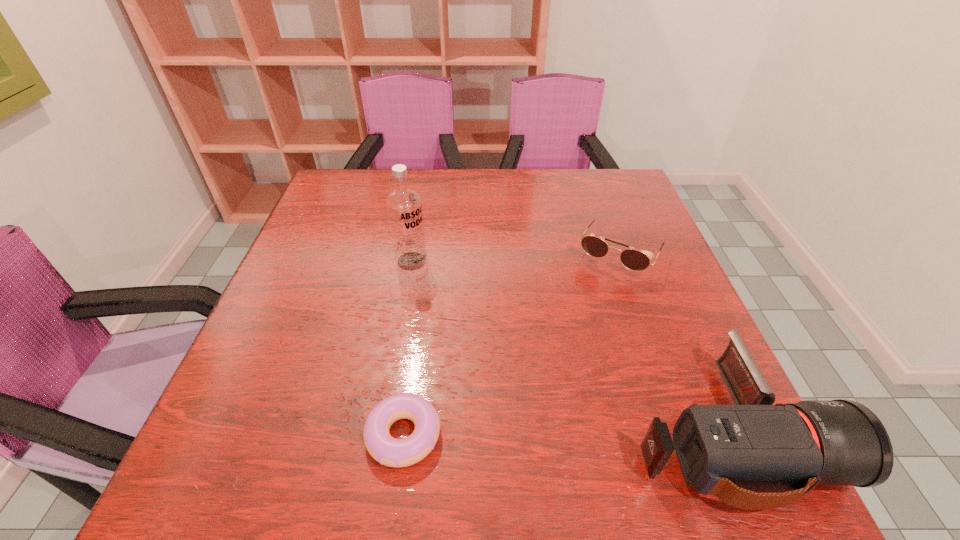
The height and width of the screenshot is (540, 960). I want to click on vacant area at the far left corner, so click(365, 186).

In the image, there is a desktop. Find the location of `vacant space at the far right corner`. vacant space at the far right corner is located at coordinates (628, 212).

Find the location of a particular element. vacant region between the doughnut and the second tallest object is located at coordinates (564, 434).

The image size is (960, 540). In order to click on empty space that is in between the doughnut and the second tallest object in this screenshot , I will do `click(564, 434)`.

Identify the location of free space between the shortest object and the sunglasses. tap(512, 345).

What are the coordinates of `free space between the vodka and the shortest object` in the screenshot? It's located at (408, 348).

The image size is (960, 540). In order to click on vacant space that's between the second shortest object and the shortest object in this screenshot , I will do `click(512, 345)`.

Locate an element on the screen. The image size is (960, 540). free area in between the shortest object and the camcorder is located at coordinates (564, 434).

Find the location of `vacant area that lies between the shortest object and the camcorder`. vacant area that lies between the shortest object and the camcorder is located at coordinates (564, 434).

Where is `empty space that is in between the third shortest object and the tallest object`? This screenshot has height=540, width=960. empty space that is in between the third shortest object and the tallest object is located at coordinates (568, 347).